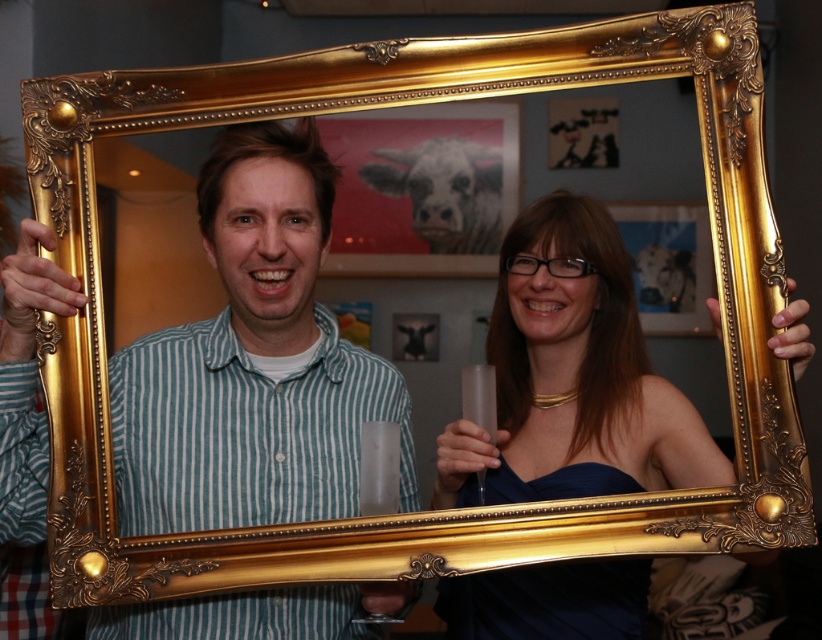
Question: Which point is closer to the camera?

Choices:
 (A) (548, 280)
 (B) (386, 609)

Answer: (B)

Question: Which object is closer to the camera taking this photo?

Choices:
 (A) matte gold frame at center
 (B) matte gold frame at right

Answer: (B)

Question: Does matte gold frame at center appear on the left side of matte gold frame at right?

Choices:
 (A) no
 (B) yes

Answer: (B)

Question: In this image, where is matte gold frame at center located relative to matte gold frame at right?

Choices:
 (A) right
 (B) left

Answer: (B)

Question: Can you confirm if matte gold frame at center is bigger than matte gold frame at right?

Choices:
 (A) yes
 (B) no

Answer: (B)